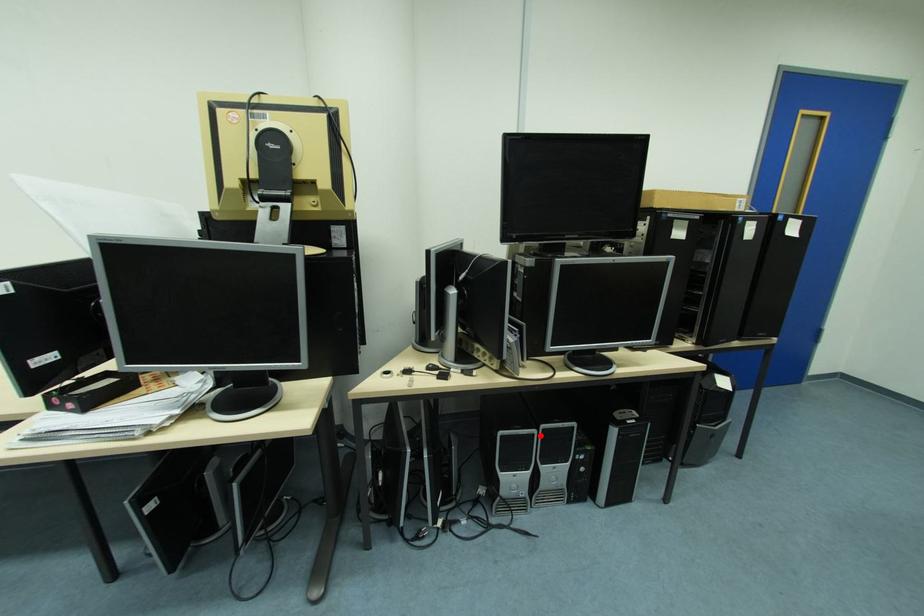
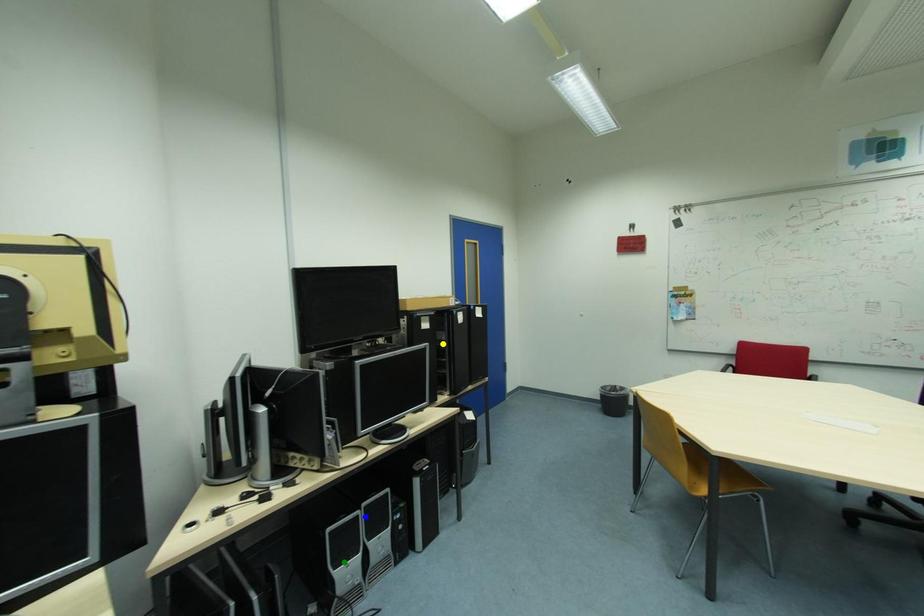
Question: I am providing you with two images of the same scene from different viewpoints. A red point is marked on the first image. You are given multiple points on the second image. Can you choose the point in image 2 that corresponds to the point in image 1?

Choices:
 (A) green point
 (B) yellow point
 (C) blue point

Answer: (C)